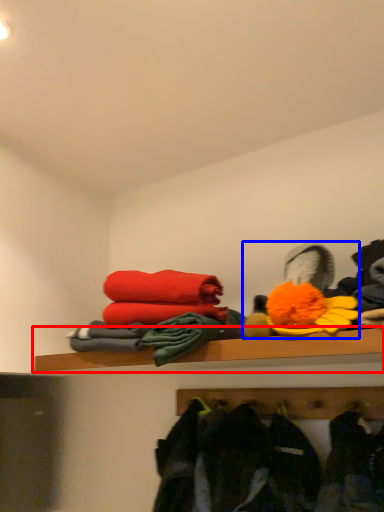
Question: Which object appears closest to the camera in this image, shelf (highlighted by a red box) or toy (highlighted by a blue box)?

Choices:
 (A) shelf
 (B) toy

Answer: (A)